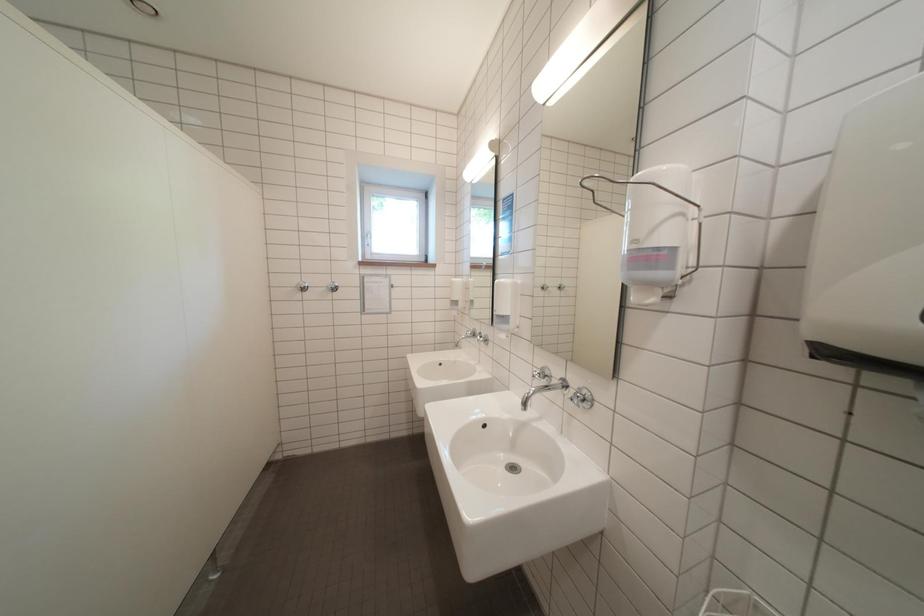
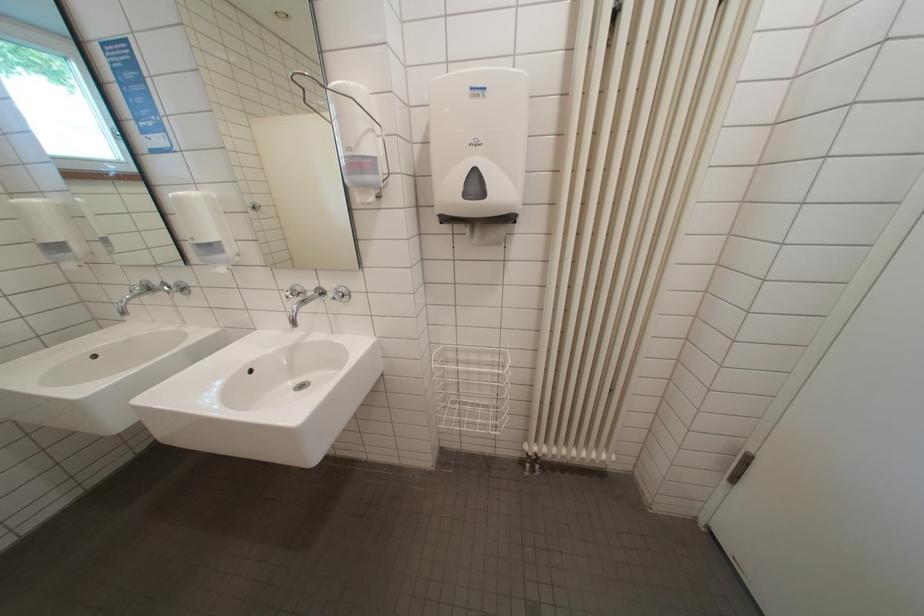
How did the camera likely rotate?

The rotation direction of the camera is right-down.